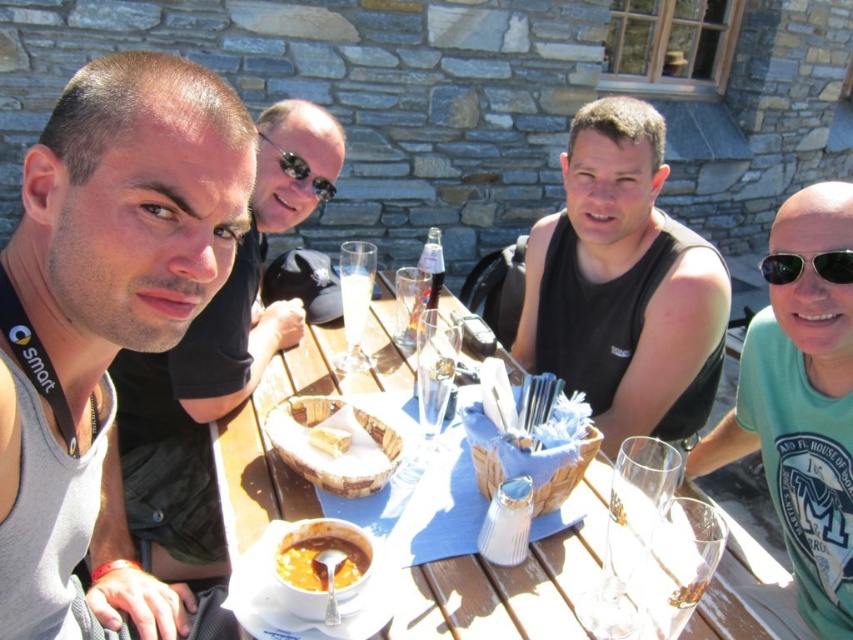
You are a photographer taking a picture of the table setup. You want to focus on the object at point [465,570] and the object at point [848,269]. Which point should you adjust your focus to first to ensure both are in sharp view?

Point [465,570] is closer to the camera than point [848,269]. To ensure both are in focus, you should adjust your focus starting with the closer point, point [465,570], then the farther point [848,269].

Consider the image. You are standing in front of the wooden table at center. If you take a step forward, will you be closer than 3 feet to the table?

The wooden table at center is 3.70 feet away from the viewer. Taking a step forward would reduce the distance, but since the original distance is 3.70 feet, stepping forward by even a small amount would bring you closer than 3 feet. Therefore, yes, you will be closer than 3 feet to the wooden table at center.